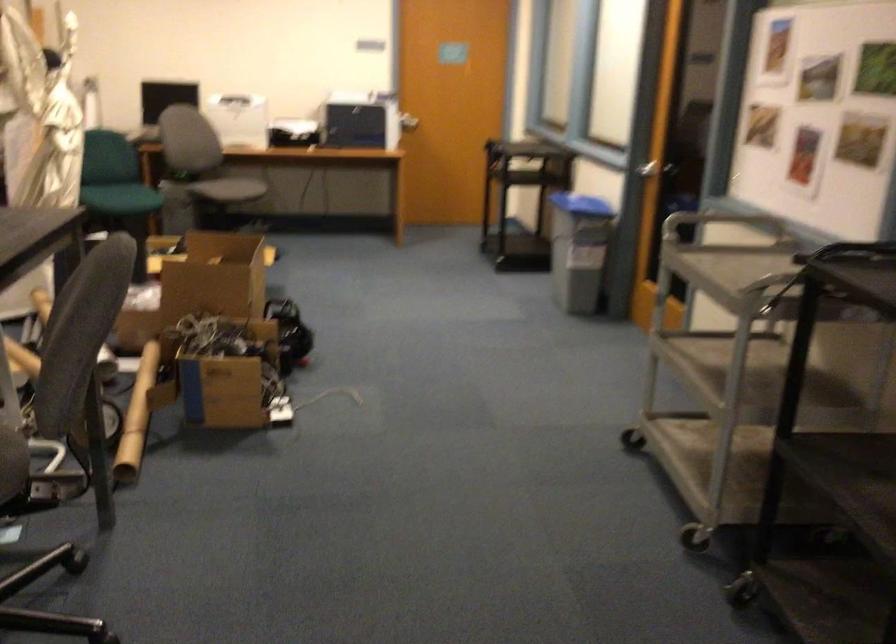
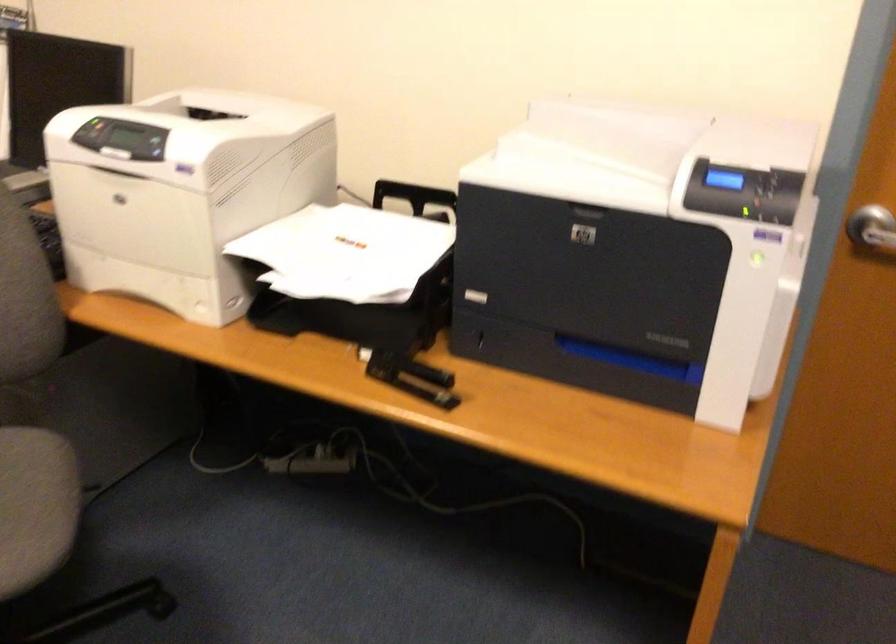
The point at (416,109) is marked in the first image. Where is the corresponding point in the second image?

(872, 230)